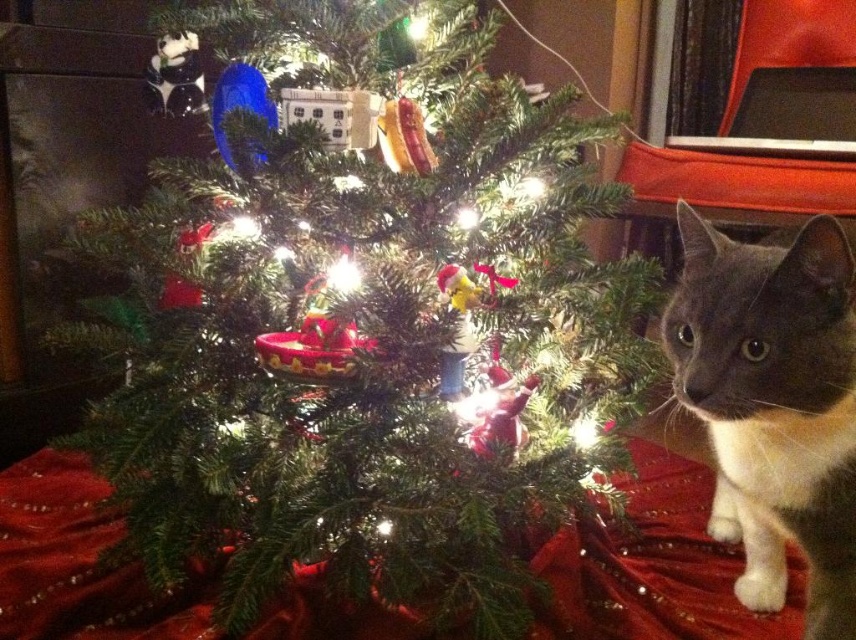
Which is behind, point (596, 204) or point (788, 362)?

Positioned behind is point (596, 204).

Is green matte christmas tree at center smaller than gray fur cat at right?

No, green matte christmas tree at center is not smaller than gray fur cat at right.

Find the location of `green matte christmas tree at center`. green matte christmas tree at center is located at coordinates (360, 352).